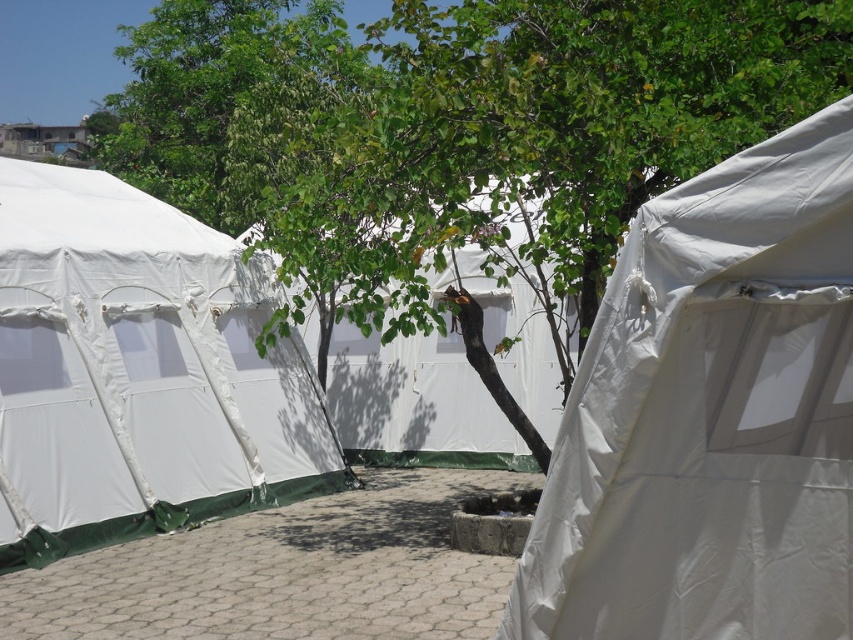
Is point (619, 484) more distant than point (695, 112)?

That is False.

Which is below, white matte tent at center or green leafy tree at center?

white matte tent at center is lower down.

You are a GUI agent. You are given a task and a screenshot of the screen. Output one action in this format:
    pyautogui.click(x=<x>, y=<y>)
    Task: Click on the white matte tent at center
    
    Given the screenshot: What is the action you would take?
    pyautogui.click(x=711, y=417)

Which is in front, point (534, 83) or point (521, 218)?

Positioned in front is point (534, 83).

Between point (585, 138) and point (540, 272), which one is positioned behind?

The point (540, 272) is more distant.

Locate an element on the screen. green leafy tree at center is located at coordinates (554, 125).

In the scene shown: Is white matte tent at center positioned behind white fabric canopy at center?

That is False.

Is point (660, 568) positioned in front of point (544, 412)?

Yes, it is in front of point (544, 412).

Which is in front, point (711, 580) or point (439, 282)?

Point (711, 580) is in front.

Identify the location of white matte tent at center. The width and height of the screenshot is (853, 640). (711, 417).